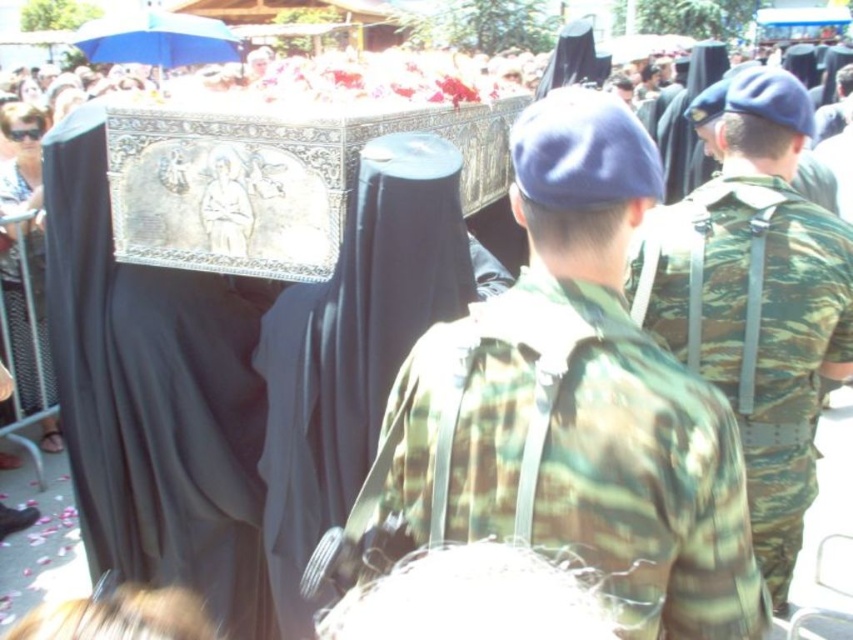
Question: Which point is closer to the camera?

Choices:
 (A) camouflage fabric backpack at center
 (B) camouflage fabric uniform at center

Answer: (A)

Question: Is camouflage fabric backpack at center above camouflage fabric uniform at center?

Choices:
 (A) no
 (B) yes

Answer: (B)

Question: Which point is closer to the camera?

Choices:
 (A) (552, 228)
 (B) (758, 376)

Answer: (A)

Question: Where is camouflage fabric backpack at center located in relation to camouflage fabric uniform at center in the image?

Choices:
 (A) above
 (B) below

Answer: (A)

Question: Can you confirm if camouflage fabric backpack at center is smaller than camouflage fabric uniform at center?

Choices:
 (A) no
 (B) yes

Answer: (B)

Question: Which of the following is the farthest from the observer?

Choices:
 (A) (648, 307)
 (B) (582, 282)

Answer: (A)